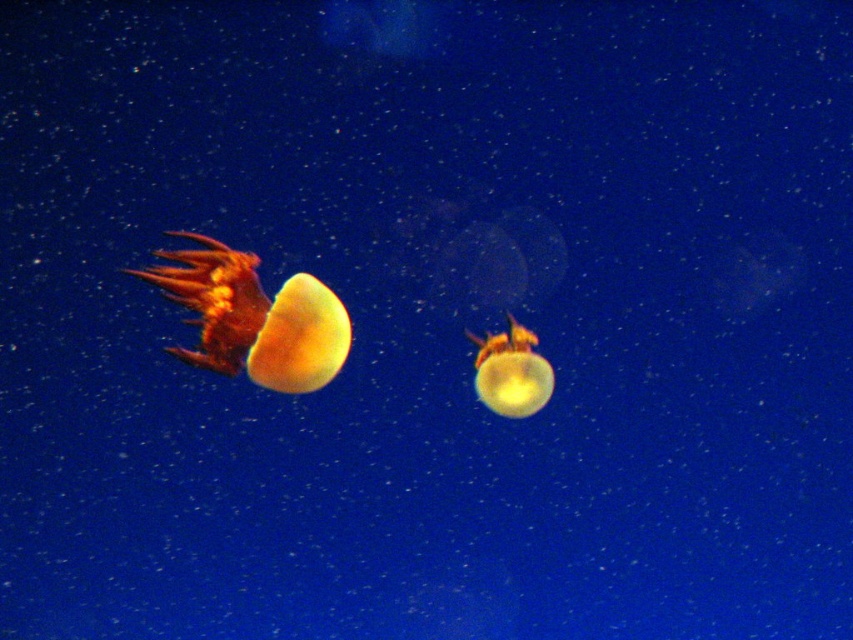
In the image of the ocean scene with two jellyfish, which one has a greater width between the translucent orange jellyfish at left and the translucent yellow jellyfish at center?

The translucent orange jellyfish at left has a greater width than the translucent yellow jellyfish at center.

You are a marine biologist observing the jellyfish in the image. You notice two jellyfish, the translucent orange jellyfish at left and the translucent yellow jellyfish at center. Which one has a greater height?

The translucent orange jellyfish at left is taller than the translucent yellow jellyfish at center.

You are a marine biologist observing the jellyfish in the image. Which jellyfish is positioned higher in the water column between the translucent orange jellyfish at left and the translucent yellow jellyfish at center?

The translucent orange jellyfish at left is positioned higher in the water column than the translucent yellow jellyfish at center.